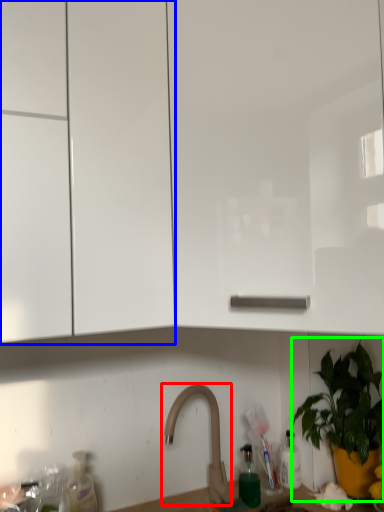
Question: Estimate the real-world distances between objects in this image. Which object is closer to tap (highlighted by a red box), cabinetry (highlighted by a blue box) or houseplant (highlighted by a green box)?

Choices:
 (A) cabinetry
 (B) houseplant

Answer: (B)